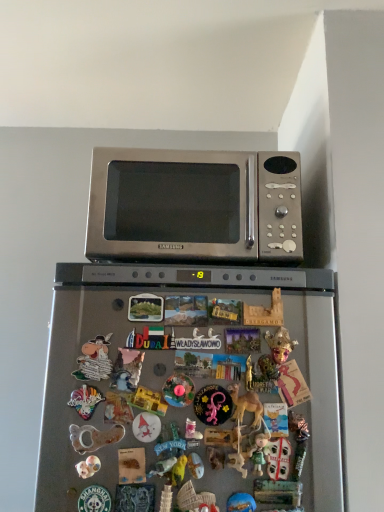
Question: Is matte plastic toy at center, marked as the 9th toy in a right-to-left arrangement, positioned in front of satin silver refrigerator at center?

Choices:
 (A) no
 (B) yes

Answer: (A)

Question: Considering the relative sizes of matte plastic toy at center, arranged as the 3th toy when viewed from the left, and satin silver refrigerator at center in the image provided, is matte plastic toy at center, arranged as the 3th toy when viewed from the left, wider than satin silver refrigerator at center?

Choices:
 (A) yes
 (B) no

Answer: (B)

Question: Considering the relative sizes of matte plastic toy at center, marked as the 9th toy in a right-to-left arrangement, and satin silver refrigerator at center in the image provided, is matte plastic toy at center, marked as the 9th toy in a right-to-left arrangement, shorter than satin silver refrigerator at center?

Choices:
 (A) yes
 (B) no

Answer: (A)

Question: Is matte plastic toy at center, marked as the 9th toy in a right-to-left arrangement, not near satin silver refrigerator at center?

Choices:
 (A) yes
 (B) no

Answer: (B)

Question: From the image's perspective, would you say matte plastic toy at center, marked as the 9th toy in a right-to-left arrangement, is shown under satin silver refrigerator at center?

Choices:
 (A) yes
 (B) no

Answer: (B)

Question: Is matte plastic toy at center, marked as the 9th toy in a right-to-left arrangement, oriented away from satin silver refrigerator at center?

Choices:
 (A) no
 (B) yes

Answer: (B)

Question: From the image's perspective, is matte green figurine at lower center, placed as the third toy when sorted from right to left, under metallic gold toy at center, the 6th toy from the right?

Choices:
 (A) no
 (B) yes

Answer: (B)

Question: Is matte green figurine at lower center, placed as the third toy when sorted from right to left, at the right side of metallic gold toy at center, which appears as the sixth toy when viewed from the left?

Choices:
 (A) yes
 (B) no

Answer: (A)

Question: Is matte green figurine at lower center, which is the ninth toy from left to right, surrounding metallic gold toy at center, the 6th toy from the right?

Choices:
 (A) yes
 (B) no

Answer: (B)

Question: Is matte green figurine at lower center, which is the ninth toy from left to right, aimed at metallic gold toy at center, which appears as the sixth toy when viewed from the left?

Choices:
 (A) yes
 (B) no

Answer: (B)

Question: Is matte green figurine at lower center, placed as the third toy when sorted from right to left, bigger than metallic gold toy at center, which appears as the sixth toy when viewed from the left?

Choices:
 (A) no
 (B) yes

Answer: (A)

Question: From the image's perspective, does matte green figurine at lower center, which is the ninth toy from left to right, appear higher than metallic gold toy at center, which appears as the sixth toy when viewed from the left?

Choices:
 (A) yes
 (B) no

Answer: (B)

Question: From the image's perspective, is satin silver refrigerator at center under metallic silver unicorn at center, arranged as the seventh toy when viewed from the right?

Choices:
 (A) no
 (B) yes

Answer: (B)